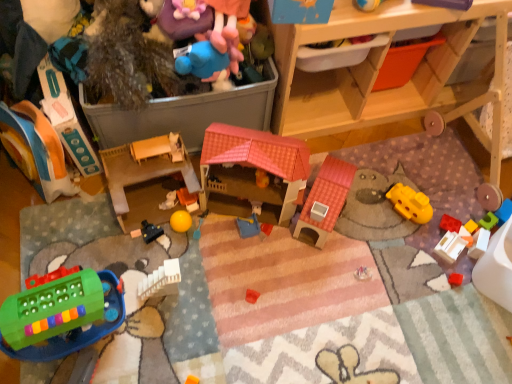
Identify the location of empty space that is in between smooth orange ball at center, positioned as the 7th toy in left-to-right order, and blue plastic toy at center, which is the fifth toy from right to left. (219, 219).